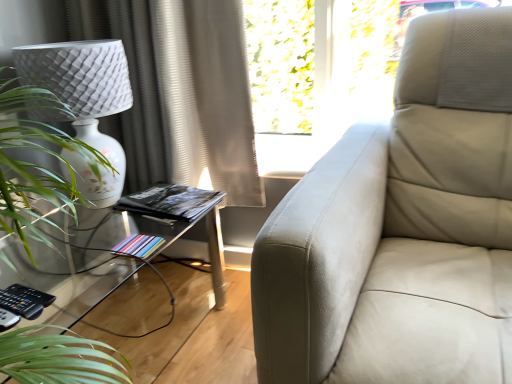
The image size is (512, 384). In order to click on vacant space underneath black matte book at center, arranged as the 2th book when ordered from the bottom (from a real-world perspective) in this screenshot , I will do `click(190, 196)`.